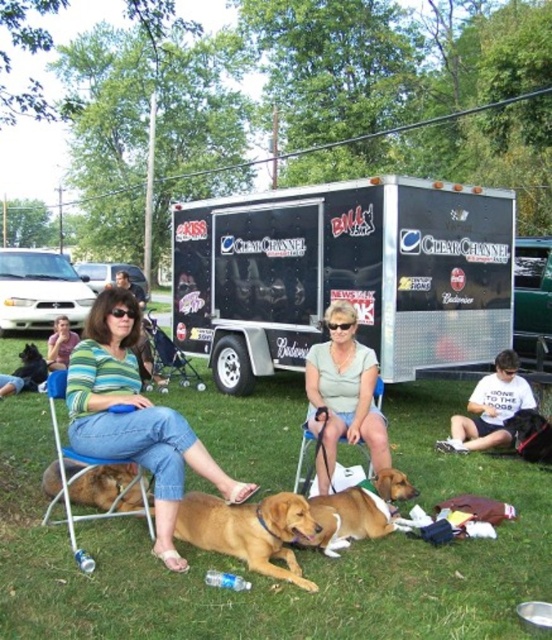
You are planning to set up a picnic blanket in the grassy area. Considering the green grass at lower center and the black fur dog at lower left, which area would be more suitable for placing the blanket without disturbing the dog?

The green grass at lower center is smaller in size compared to the black fur dog at lower left. Since the dog is at the lower left, placing the blanket on the green grass at lower center would be more suitable as it is farther from the dog and less likely to disturb it.

You are standing in the park and see the green grass at lower center and the black fur dog at lower left. Which object is positioned to the right of the other?

The green grass at lower center is positioned to the right of the black fur dog at lower left.